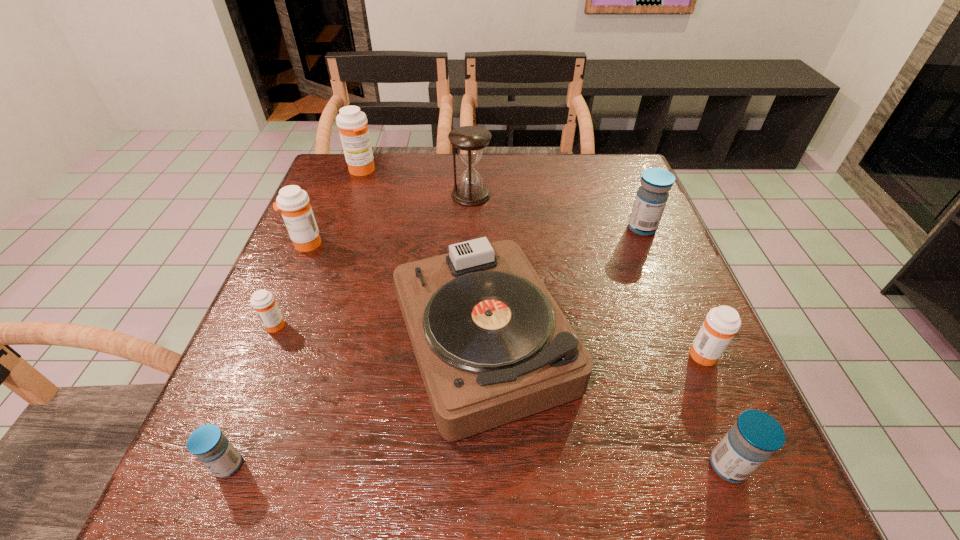
The height and width of the screenshot is (540, 960). In the image, there is a desktop. Identify the location of free region at the far left corner. (355, 194).

Where is `vacant region at the near left corner`? vacant region at the near left corner is located at coordinates (209, 487).

Identify the location of vacant space that's between the farthest object and the second farthest orange medicine. The height and width of the screenshot is (540, 960). (334, 207).

I want to click on unoccupied position between the farthest medicine and the fourth nearest medicine, so click(319, 247).

This screenshot has height=540, width=960. I want to click on vacant area between the second farthest orange medicine and the farthest blue medicine, so click(x=474, y=236).

In order to click on vacant point located between the third smallest orange medicine and the fourth nearest medicine in this screenshot , I will do `click(291, 284)`.

The image size is (960, 540). What are the coordinates of `unoccupied position between the biggest blue medicine and the second biggest blue medicine` in the screenshot? It's located at (684, 347).

The image size is (960, 540). I want to click on free space between the smallest blue medicine and the record player, so click(356, 402).

The height and width of the screenshot is (540, 960). In order to click on vacant space that's between the farthest object and the hourglass in this screenshot , I will do `click(417, 183)`.

At what (x,y) coordinates should I click in order to perform the action: click on vacant space that is in between the leftmost blue medicine and the eighth nearest object. Please return your answer as a coordinate pair (x, y). Looking at the image, I should click on (349, 330).